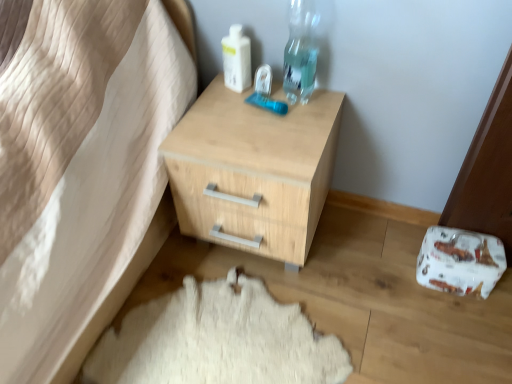
Identify the location of vacant point above natural wood chest of drawers at center (from a real-world perspective). This screenshot has height=384, width=512. (249, 123).